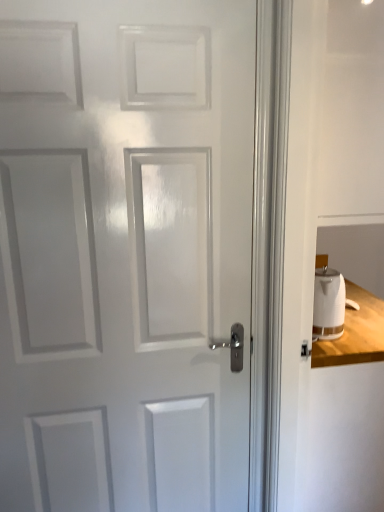
This screenshot has width=384, height=512. Describe the element at coordinates (328, 304) in the screenshot. I see `white glossy electric kettle at right` at that location.

Locate an element on the screen. Image resolution: width=384 pixels, height=512 pixels. white glossy electric kettle at right is located at coordinates (328, 304).

The image size is (384, 512). What do you see at coordinates (124, 254) in the screenshot?
I see `white glossy door at center` at bounding box center [124, 254].

The height and width of the screenshot is (512, 384). What are the coordinates of `white glossy door at center` in the screenshot? It's located at (124, 254).

I want to click on white glossy electric kettle at right, so click(328, 304).

Is white glossy door at center to the left or to the right of white glossy electric kettle at right in the image?

Clearly, white glossy door at center is on the left of white glossy electric kettle at right in the image.

Relative to white glossy electric kettle at right, is white glossy door at center in front or behind?

white glossy door at center is positioned closer to the viewer than white glossy electric kettle at right.

Is point (137, 379) positioned after point (339, 314)?

No.

From the image's perspective, between white glossy door at center and white glossy electric kettle at right, who is located below?

white glossy electric kettle at right.

From the picture: From a real-world perspective, which object rests below the other?

white glossy electric kettle at right, from a real-world perspective.

Is white glossy door at center wider than white glossy electric kettle at right?

No, white glossy door at center is not wider than white glossy electric kettle at right.

Between white glossy door at center and white glossy electric kettle at right, which one has less height?

white glossy electric kettle at right.

Which of these two, white glossy door at center or white glossy electric kettle at right, is smaller?

white glossy electric kettle at right is smaller.

Is white glossy door at center not within white glossy electric kettle at right?

white glossy door at center lies outside white glossy electric kettle at right's area.

Is white glossy door at center far away from white glossy electric kettle at right?

No, white glossy door at center is in close proximity to white glossy electric kettle at right.

Is white glossy electric kettle at right at the back of white glossy door at center?

No.

Can you tell me how much white glossy door at center and white glossy electric kettle at right differ in facing direction?

88.8 degrees separate the facing orientations of white glossy door at center and white glossy electric kettle at right.

The width and height of the screenshot is (384, 512). I want to click on toilet paper lying on the right of white glossy door at center, so click(328, 304).

Considering the positions of objects white glossy electric kettle at right and white glossy door at center in the image provided, who is more to the left, white glossy electric kettle at right or white glossy door at center?

From the viewer's perspective, white glossy door at center appears more on the left side.

Considering their positions, is white glossy electric kettle at right located in front of or behind white glossy door at center?

white glossy electric kettle at right is behind white glossy door at center.

Between point (324, 319) and point (75, 96), which one is positioned in front?

Positioned in front is point (75, 96).

From the image's perspective, which one is positioned lower, white glossy electric kettle at right or white glossy door at center?

white glossy electric kettle at right is shown below in the image.

Based on the photo, from a real-world perspective, is white glossy electric kettle at right physically below white glossy door at center?

Yes, from a real-world perspective, white glossy electric kettle at right is under white glossy door at center.

Can you confirm if white glossy electric kettle at right is wider than white glossy door at center?

Correct, the width of white glossy electric kettle at right exceeds that of white glossy door at center.

Is white glossy electric kettle at right taller or shorter than white glossy door at center?

Considering their sizes, white glossy electric kettle at right has less height than white glossy door at center.

Between white glossy electric kettle at right and white glossy door at center, which one has smaller size?

white glossy electric kettle at right is smaller.

Is white glossy door at center completely or partially inside white glossy electric kettle at right?

No, white glossy door at center is not inside white glossy electric kettle at right.

Is there a large distance between white glossy electric kettle at right and white glossy door at center?

That's not correct — white glossy electric kettle at right is a little close to white glossy door at center.

In the scene shown: Is white glossy electric kettle at right aimed at white glossy door at center?

No, white glossy electric kettle at right is not oriented towards white glossy door at center.

The width and height of the screenshot is (384, 512). I want to click on door on the left of white glossy electric kettle at right, so click(x=124, y=254).

The height and width of the screenshot is (512, 384). I want to click on door located above the white glossy electric kettle at right (from a real-world perspective), so click(124, 254).

At what (x,y) coordinates should I click in order to perform the action: click on door lying in front of the white glossy electric kettle at right. Please return your answer as a coordinate pair (x, y). Image resolution: width=384 pixels, height=512 pixels. Looking at the image, I should click on (124, 254).